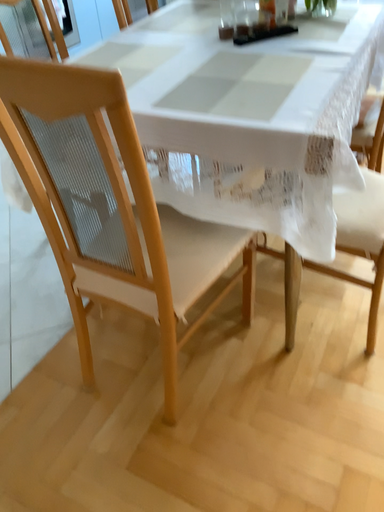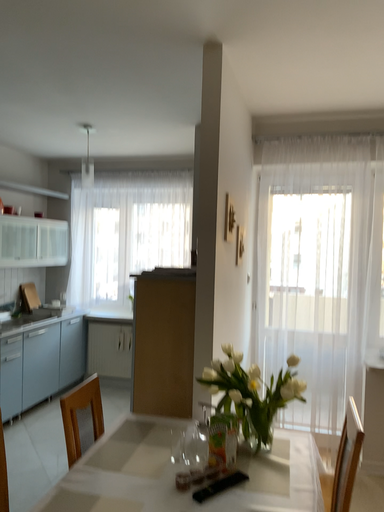
Question: Which way did the camera rotate in the video?

Choices:
 (A) rotated left
 (B) rotated right

Answer: (B)